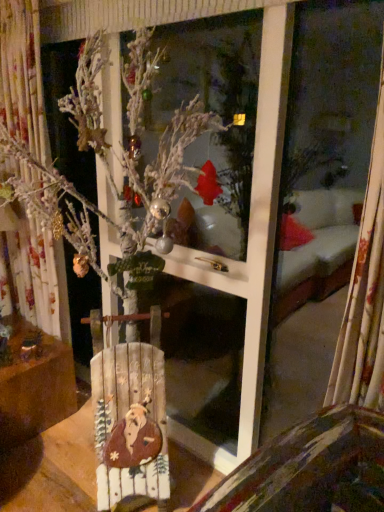
Identify the location of free space to the left of wooden sign at center. This screenshot has width=384, height=512. (69, 486).